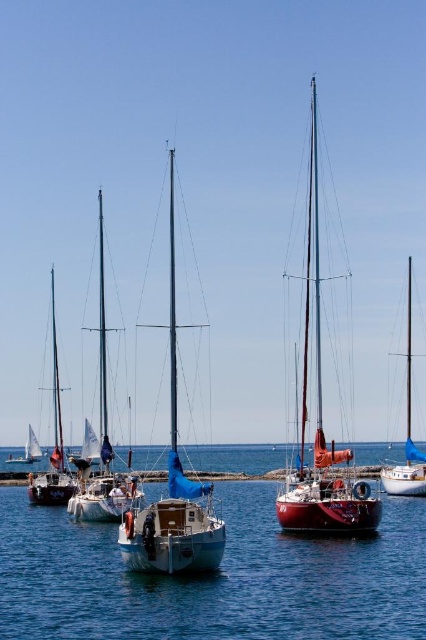
You are standing at the edge of the marina and see the point marked at coordinates (213, 579). Based on the scene, what is the location of this point relative to the clear blue water at center?

The point marked at coordinates (213, 579) is located on the clear blue water at center.

You are standing at the edge of the marina and notice the clear blue water at center and the shiny red sailboat at center. Which object is positioned to the left when viewed from your perspective?

The clear blue water at center is to the left of the shiny red sailboat at center from your perspective.

You are a photographer planning to capture the white glossy sailboat at center and the clear blue water at center in a single frame. Based on their sizes, which object should you focus on first to ensure both are clearly visible in your photo?

The white glossy sailboat at center is larger than the clear blue water at center, so focusing on the sailboat first would help ensure both objects are clearly visible in the photo.